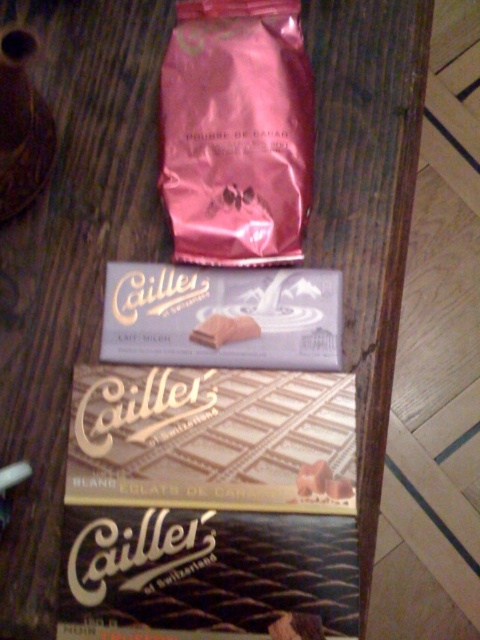
You are a delivery person trying to place a new package on the wooden surface. You need to know which of the two points, point (275, 289) or point (213, 330), is closer to you so you can avoid placing the package there. Which point is closer?

Point (275, 289) is further to the viewer than point (213, 330), so the closer point to you is point (213, 330).

You are a delivery person who needs to place a new package on the wooden surface. There are two points marked on the surface where you can place it. The first point is at coordinate point(x=84, y=452) and the second is at point(x=269, y=289). Which point is closer to you?

Point(x=84, y=452) is in front of point(x=269, y=289), so it is closer to you.

You are trying to pack these two chocolate bars into a gift box that can only accommodate items up to 10 cm in width. Given that the gold foil chocolate bar at center is wider than the white matte chocolate bar at center, can both fit side by side if the total width required is 18 cm?

The gold foil chocolate bar at center is wider than the white matte chocolate bar at center. If their combined width is 18 cm, which exceeds the gift box capacity of 10 cm, both cannot fit side by side.